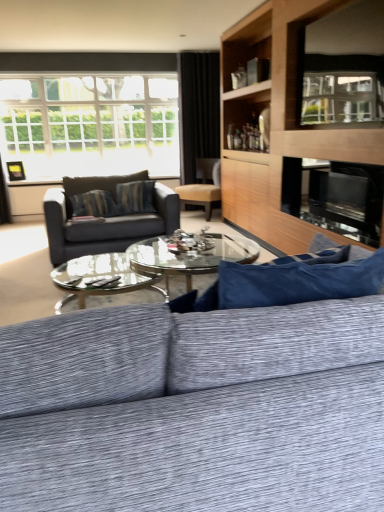
What do you see at coordinates (106, 221) in the screenshot? The height and width of the screenshot is (512, 384). I see `matte black couch at center, arranged as the 2th studio couch when viewed from the front` at bounding box center [106, 221].

What do you see at coordinates (16, 170) in the screenshot? Image resolution: width=384 pixels, height=512 pixels. I see `metallic gold picture frame at upper left` at bounding box center [16, 170].

Find the location of `black fabric curtain at upper center`. black fabric curtain at upper center is located at coordinates (198, 110).

Describe the element at coordinates (281, 125) in the screenshot. This screenshot has height=512, width=384. I see `wooden entertainment center at upper right` at that location.

Describe the element at coordinates (203, 186) in the screenshot. I see `matte brown chair at center` at that location.

The width and height of the screenshot is (384, 512). What do you see at coordinates (335, 197) in the screenshot?
I see `black glass fireplace at center` at bounding box center [335, 197].

At what (x,y) coordinates should I click in order to perform the action: click on matte black couch at center, arranged as the 2th studio couch when viewed from the front. Please return your answer as a coordinate pair (x, y). The image size is (384, 512). Looking at the image, I should click on (106, 221).

Could you tell me if black fabric curtain at upper center is facing textured gray couch at center, which ranks as the second studio couch in back-to-front order?

No, black fabric curtain at upper center is not turned towards textured gray couch at center, which ranks as the second studio couch in back-to-front order.

Is black fabric curtain at upper center bigger than textured gray couch at center, which ranks as the second studio couch in back-to-front order?

Actually, black fabric curtain at upper center might be smaller than textured gray couch at center, which ranks as the second studio couch in back-to-front order.

Is black fabric curtain at upper center taller than textured gray couch at center, which ranks as the second studio couch in back-to-front order?

Yes, black fabric curtain at upper center is taller than textured gray couch at center, which ranks as the second studio couch in back-to-front order.

This screenshot has width=384, height=512. In order to click on curtain behind the textured gray couch at center, which ranks as the second studio couch in back-to-front order in this screenshot , I will do `click(198, 110)`.

Which is in front, point (50, 257) or point (302, 65)?

The point (302, 65) is closer to the camera.

From a real-world perspective, is matte black couch at center, arranged as the 2th studio couch when viewed from the front, positioned under wooden entertainment center at upper right based on gravity?

Yes, from a real-world perspective, matte black couch at center, arranged as the 2th studio couch when viewed from the front, is beneath wooden entertainment center at upper right.

How far apart are matte black couch at center, arranged as the 2th studio couch when viewed from the front, and wooden entertainment center at upper right?

matte black couch at center, arranged as the 2th studio couch when viewed from the front, and wooden entertainment center at upper right are 1.35 meters apart from each other.

From the image's perspective, is matte black couch at center, marked as the first studio couch in a back-to-front arrangement, on top of wooden entertainment center at upper right?

No, from the image's perspective, matte black couch at center, marked as the first studio couch in a back-to-front arrangement, is not on top of wooden entertainment center at upper right.

In the scene shown: How distant is matte brown chair at center from clear glass window screen at upper right?

A distance of 9.12 feet exists between matte brown chair at center and clear glass window screen at upper right.

Is matte brown chair at center positioned beyond the bounds of clear glass window screen at upper right?

Yes, matte brown chair at center is not within clear glass window screen at upper right.

Is matte brown chair at center aimed at clear glass window screen at upper right?

No.

Is the depth of black glass fireplace at center greater than that of wooden entertainment center at upper right?

Yes.

Is black glass fireplace at center wider or thinner than wooden entertainment center at upper right?

In the image, black glass fireplace at center appears to be more narrow than wooden entertainment center at upper right.

Would you say black glass fireplace at center is a long distance from wooden entertainment center at upper right?

That's not correct — black glass fireplace at center is a little close to wooden entertainment center at upper right.

Is black glass fireplace at center not inside wooden entertainment center at upper right?

No, black glass fireplace at center is inside or overlapping with wooden entertainment center at upper right.

Are black glass fireplace at center and metallic gold picture frame at upper left making contact?

No.

Considering the relative sizes of black glass fireplace at center and metallic gold picture frame at upper left in the image provided, is black glass fireplace at center bigger than metallic gold picture frame at upper left?

Correct, black glass fireplace at center is larger in size than metallic gold picture frame at upper left.

From the image's perspective, which one is positioned lower, black glass fireplace at center or metallic gold picture frame at upper left?

black glass fireplace at center.

From a real-world perspective, is black glass fireplace at center beneath metallic gold picture frame at upper left?

Yes, from a real-world perspective, black glass fireplace at center is below metallic gold picture frame at upper left.

Where is `fireplace on the right of clear glass window screen at upper right`? The image size is (384, 512). fireplace on the right of clear glass window screen at upper right is located at coordinates (335, 197).

Does point (311, 28) come closer to viewer compared to point (357, 204)?

Yes, it is in front of point (357, 204).

Is clear glass window screen at upper right facing towards black glass fireplace at center?

No, clear glass window screen at upper right is not turned towards black glass fireplace at center.

How different are the orientations of textured gray couch at center, the first studio couch viewed from the front, and black glass fireplace at center in degrees?

The angular difference between textured gray couch at center, the first studio couch viewed from the front, and black glass fireplace at center is 90.1 degrees.

Who is bigger, textured gray couch at center, which ranks as the second studio couch in back-to-front order, or black glass fireplace at center?

With larger size is textured gray couch at center, which ranks as the second studio couch in back-to-front order.

From a real-world perspective, is textured gray couch at center, the first studio couch viewed from the front, under black glass fireplace at center?

Yes, from a real-world perspective, textured gray couch at center, the first studio couch viewed from the front, is below black glass fireplace at center.

Between textured gray couch at center, the first studio couch viewed from the front, and black glass fireplace at center, which one appears on the right side from the viewer's perspective?

black glass fireplace at center.

What are the coordinates of `curtain above the textured gray couch at center, which ranks as the second studio couch in back-to-front order (from a real-world perspective)` in the screenshot? It's located at (198, 110).

I want to click on entertainment center that appears in front of the matte black couch at center, arranged as the 2th studio couch when viewed from the front, so click(x=281, y=125).

Which object lies further to the anchor point matte black couch at center, marked as the first studio couch in a back-to-front arrangement, metallic gold picture frame at upper left or matte brown chair at center?

metallic gold picture frame at upper left lies further to matte black couch at center, marked as the first studio couch in a back-to-front arrangement, than the other object.

Which object lies nearer to the anchor point clear glass window screen at upper right, matte brown chair at center or black fabric curtain at upper center?

Based on the image, matte brown chair at center appears to be nearer to clear glass window screen at upper right.

Looking at the image, which one is located closer to textured gray couch at center, which ranks as the second studio couch in back-to-front order, clear glass window screen at upper right or wooden entertainment center at upper right?

The object closer to textured gray couch at center, which ranks as the second studio couch in back-to-front order, is clear glass window screen at upper right.

Looking at the image, which one is located closer to clear glass window screen at upper right, metallic gold picture frame at upper left or matte brown chair at center?

matte brown chair at center is positioned closer to the anchor clear glass window screen at upper right.

Based on their spatial positions, is white glass window at upper left or black glass fireplace at center closer to matte black couch at center, arranged as the 2th studio couch when viewed from the front?

Based on the image, black glass fireplace at center appears to be nearer to matte black couch at center, arranged as the 2th studio couch when viewed from the front.

Based on their spatial positions, is matte black couch at center, marked as the first studio couch in a back-to-front arrangement, or clear glass window screen at upper right further from black fabric curtain at upper center?

clear glass window screen at upper right lies further to black fabric curtain at upper center than the other object.

Looking at the image, which one is located further to black glass fireplace at center, matte brown chair at center or white glass window at upper left?

white glass window at upper left lies further to black glass fireplace at center than the other object.

Considering their positions, is matte brown chair at center positioned closer to black glass fireplace at center than metallic gold picture frame at upper left?

matte brown chair at center is positioned closer to the anchor black glass fireplace at center.

This screenshot has width=384, height=512. I want to click on curtain positioned between black glass fireplace at center and metallic gold picture frame at upper left from near to far, so click(198, 110).

Where is `fireplace between clear glass window screen at upper right and black fabric curtain at upper center in the front-back direction`? fireplace between clear glass window screen at upper right and black fabric curtain at upper center in the front-back direction is located at coordinates (335, 197).

In order to click on chair between textured gray couch at center, the first studio couch viewed from the front, and black fabric curtain at upper center, along the z-axis in this screenshot , I will do `click(203, 186)`.

At what (x,y) coordinates should I click in order to perform the action: click on entertainment center between matte black couch at center, marked as the first studio couch in a back-to-front arrangement, and clear glass window screen at upper right, in the horizontal direction. Please return your answer as a coordinate pair (x, y). This screenshot has width=384, height=512. Looking at the image, I should click on (281, 125).